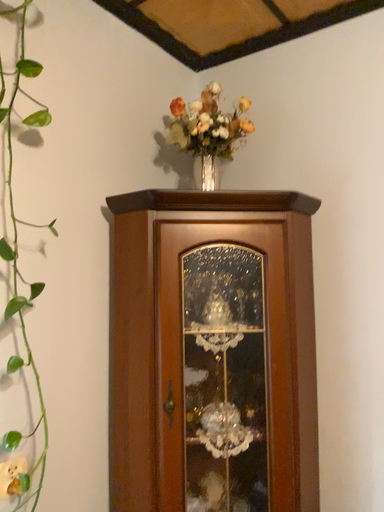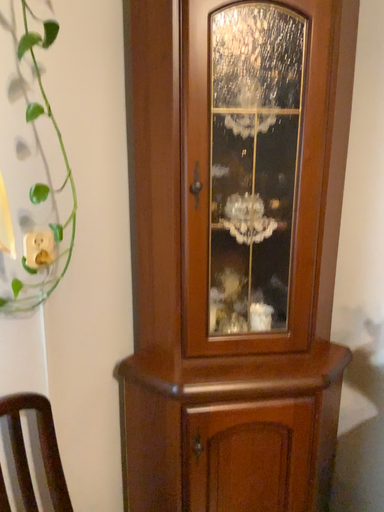
Question: Which way did the camera rotate in the video?

Choices:
 (A) rotated downward
 (B) rotated upward

Answer: (A)